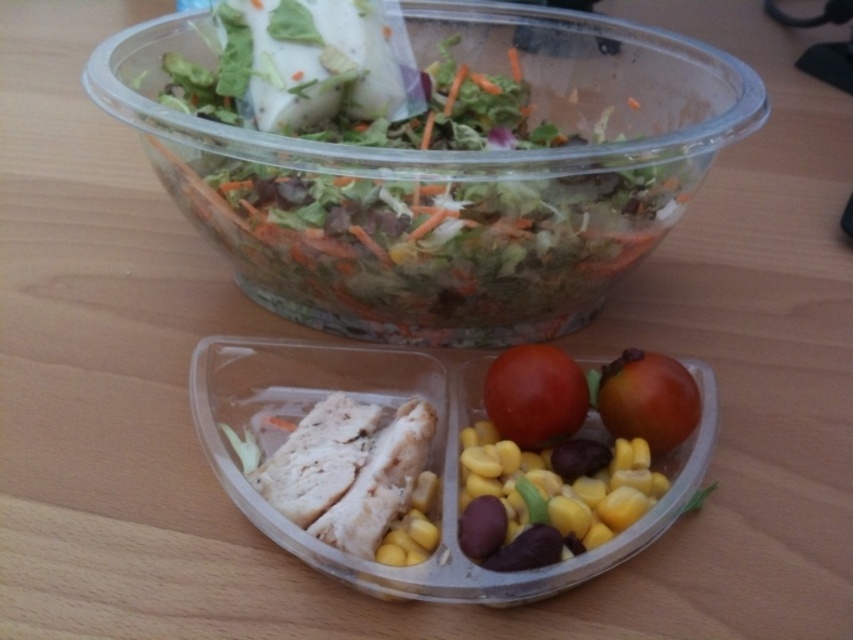
Does translucent plastic bowl at upper center appear on the left side of glossy red tomato at center?

Yes, translucent plastic bowl at upper center is to the left of glossy red tomato at center.

The image size is (853, 640). Identify the location of translucent plastic bowl at upper center. (444, 176).

Who is more forward, (360, 131) or (676, 381)?

Point (676, 381) is in front.

Locate an element on the screen. translucent plastic bowl at upper center is located at coordinates (444, 176).

Does translucent plastic bowl at upper center have a greater width compared to red matte tomato at center?

Yes.

The height and width of the screenshot is (640, 853). In order to click on translucent plastic bowl at upper center in this screenshot , I will do `click(444, 176)`.

Is red matte tomato at center thinner than glossy red tomato at center?

In fact, red matte tomato at center might be wider than glossy red tomato at center.

Does point (537, 420) lie in front of point (598, 397)?

That is True.

Which is behind, point (570, 404) or point (653, 403)?

The point (570, 404) is more distant.

The width and height of the screenshot is (853, 640). Find the location of `red matte tomato at center`. red matte tomato at center is located at coordinates (535, 396).